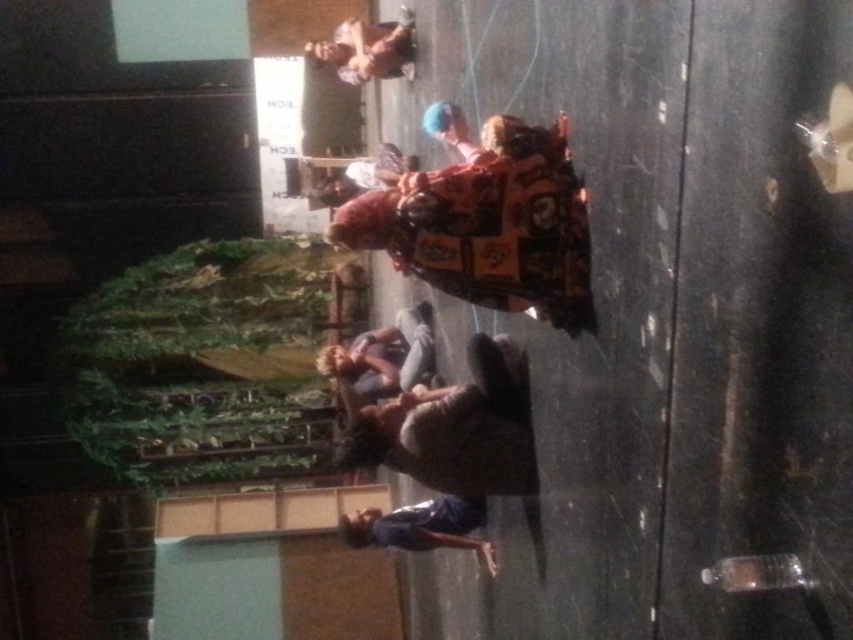
Looking at this image, can you confirm if matte gray skateboard at center is thinner than matte plastic doll at upper center?

In fact, matte gray skateboard at center might be wider than matte plastic doll at upper center.

Identify the location of matte gray skateboard at center. This screenshot has height=640, width=853. (456, 428).

Between point (486, 387) and point (397, 67), which one is positioned behind?

Point (397, 67)

Where is `matte gray skateboard at center`? matte gray skateboard at center is located at coordinates tap(456, 428).

In the scene shown: Is matte gray skateboard at center taller than dark blue jersey at lower center?

Indeed, matte gray skateboard at center has a greater height compared to dark blue jersey at lower center.

What do you see at coordinates (456, 428) in the screenshot?
I see `matte gray skateboard at center` at bounding box center [456, 428].

The width and height of the screenshot is (853, 640). I want to click on matte gray skateboard at center, so click(x=456, y=428).

Which of these two, dark blue jersey at lower center or matte plastic doll at upper center, stands taller?

Standing taller between the two is matte plastic doll at upper center.

Can you confirm if dark blue jersey at lower center is wider than matte plastic doll at upper center?

Yes, dark blue jersey at lower center is wider than matte plastic doll at upper center.

Find the location of `dark blue jersey at lower center`. dark blue jersey at lower center is located at coordinates (421, 525).